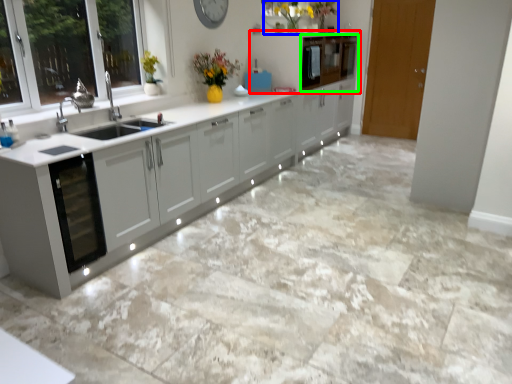
Question: Considering the real-world distances, which object is farthest from cabinetry (highlighted by a red box)? floral arrangement (highlighted by a blue box) or cabinetry (highlighted by a green box)?

Choices:
 (A) floral arrangement
 (B) cabinetry

Answer: (A)